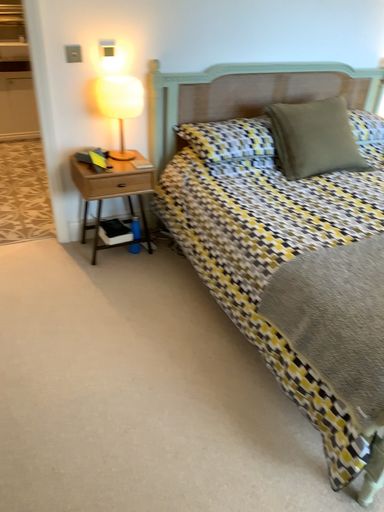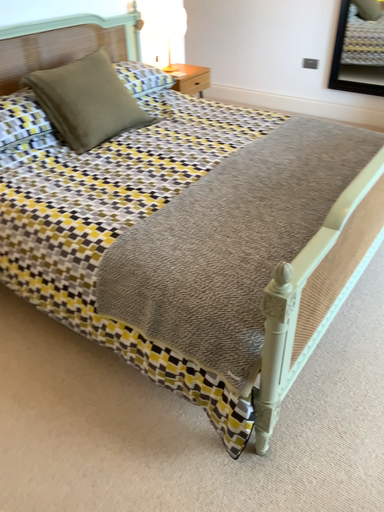
Question: Which way did the camera rotate in the video?

Choices:
 (A) rotated left
 (B) rotated right

Answer: (B)